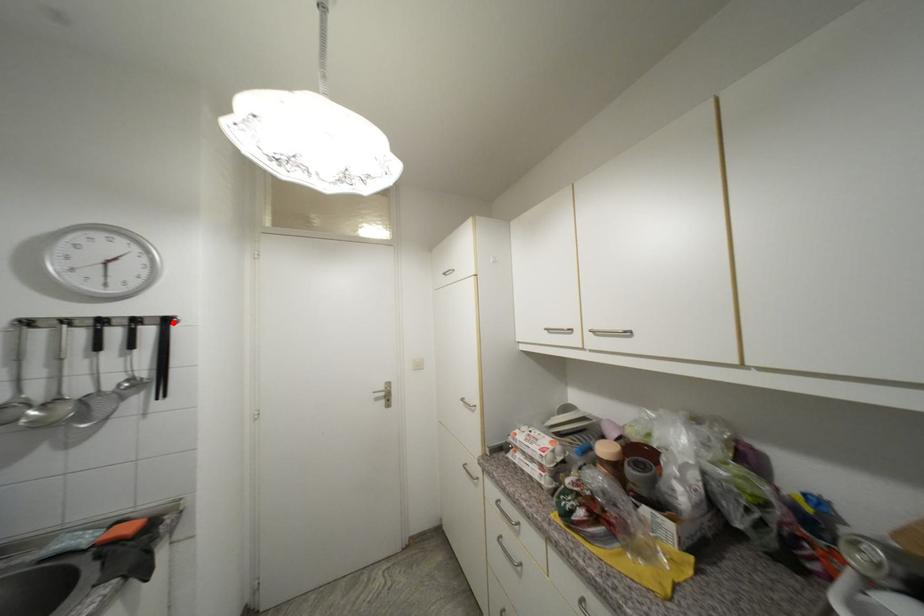
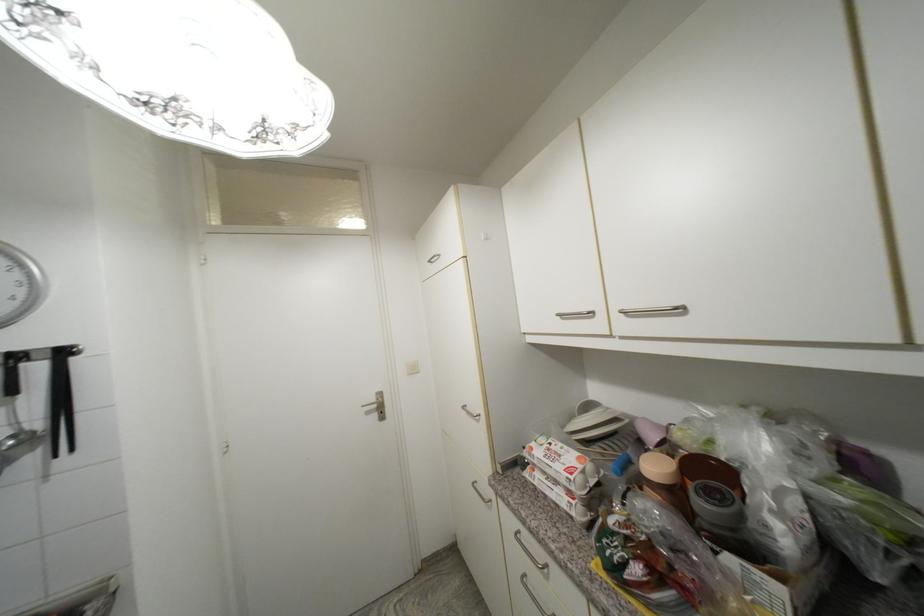
Find the pixel in the second image that matches the highlighted location in the first image.

(69, 354)